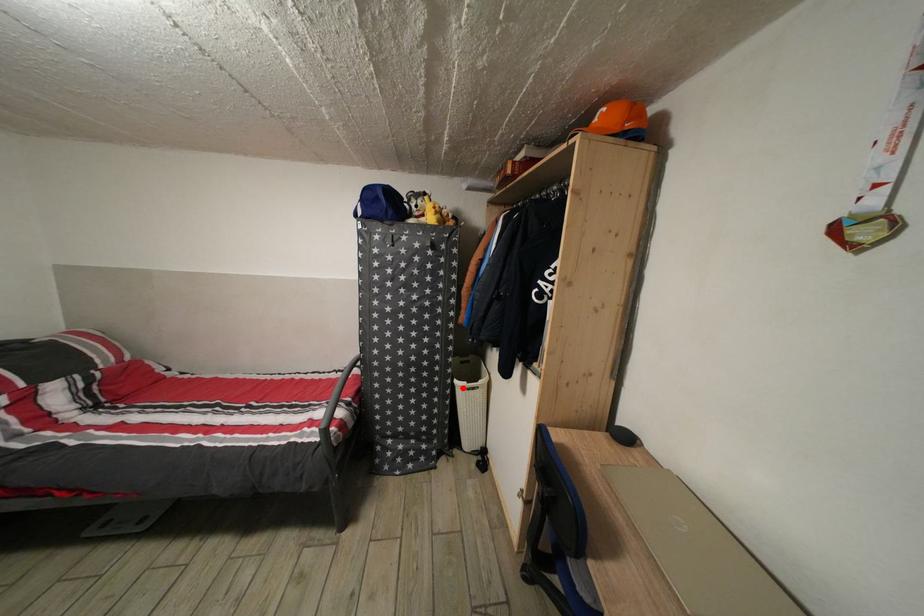
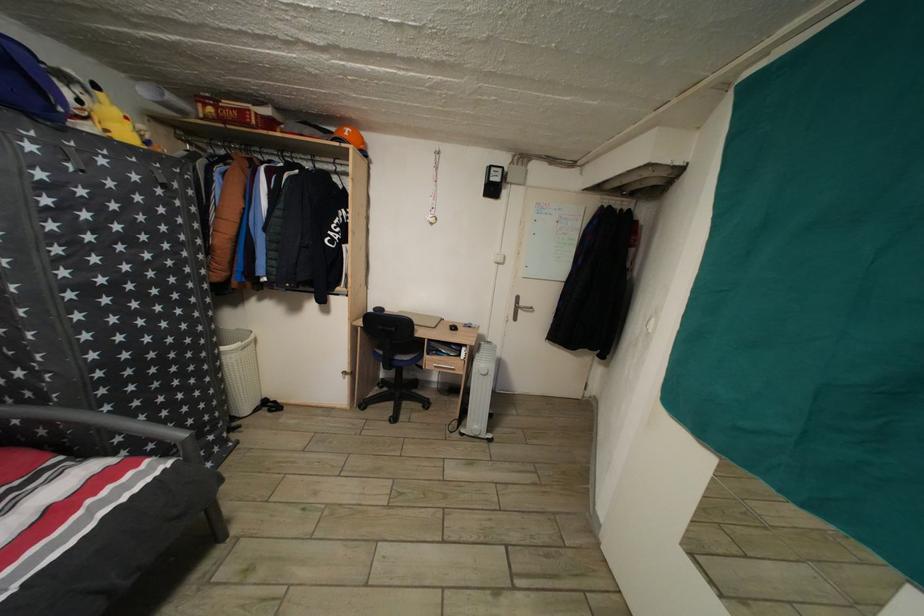
Where in the second image is the point corresponding to the highlighted location from the first image?

(229, 355)